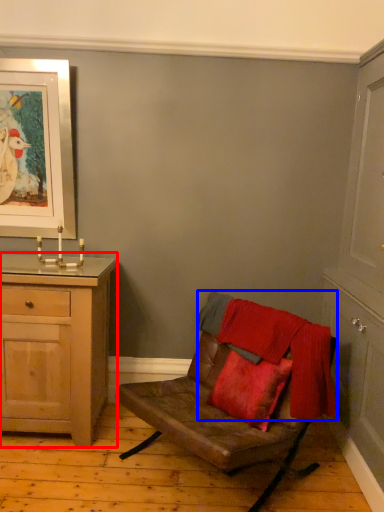
Question: Among these objects, which one is nearest to the camera, chest of drawers (highlighted by a red box) or blanket (highlighted by a blue box)?

Choices:
 (A) chest of drawers
 (B) blanket

Answer: (B)